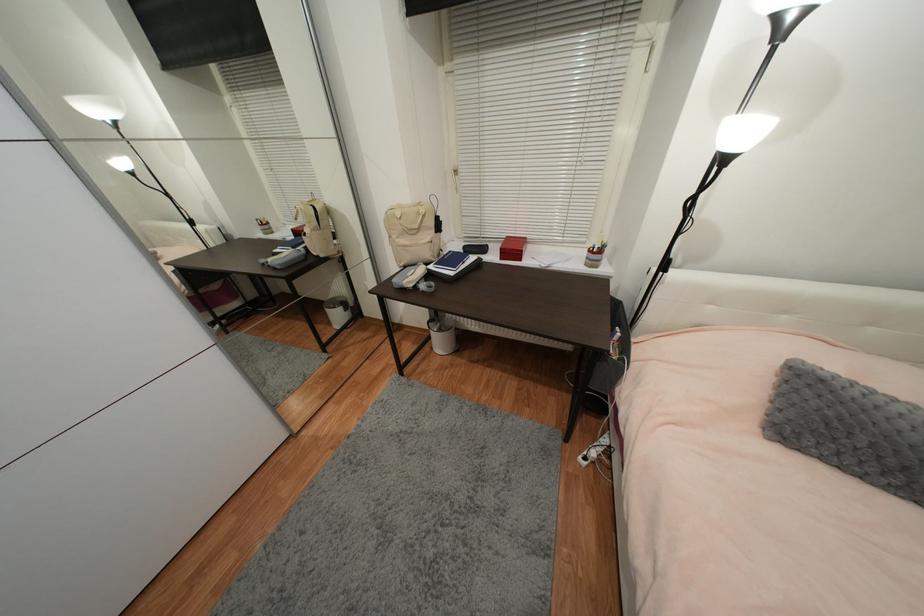
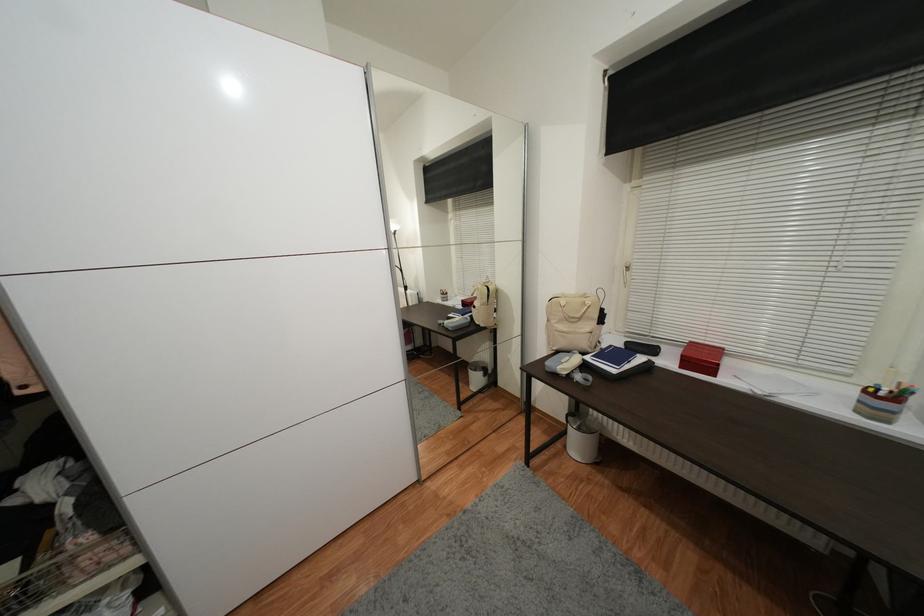
Find the pixel in the second image that matches point 436,350 in the first image.

(569, 448)